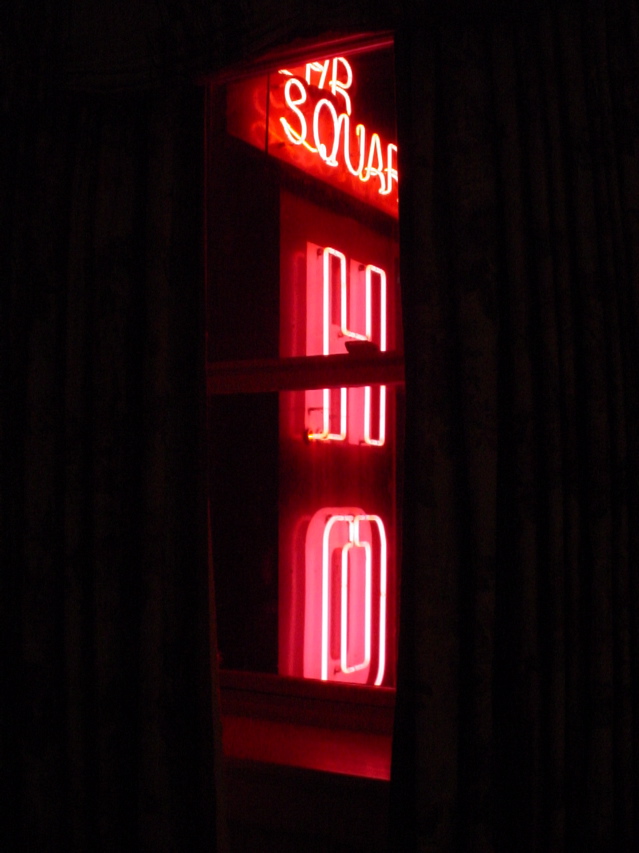
At what (x,y) coordinates should I click in order to perform the action: click on window. Please return your answer as a coordinate pair (x, y). This screenshot has width=639, height=853. Looking at the image, I should click on (239, 235), (233, 517).